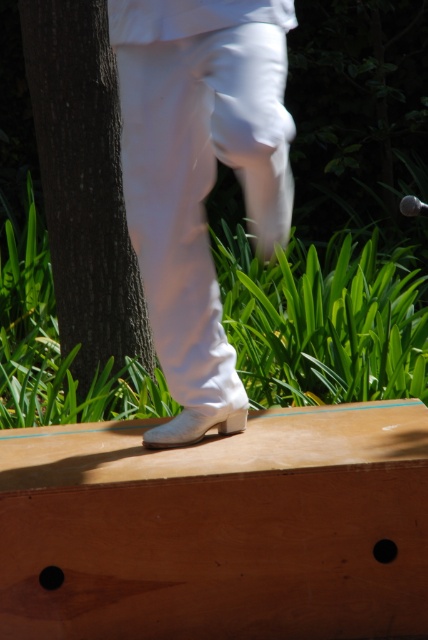
Question: Is white leather boot at center to the right of brown rough bark at left from the viewer's perspective?

Choices:
 (A) no
 (B) yes

Answer: (B)

Question: Which object appears farthest from the camera in this image?

Choices:
 (A) brown rough bark at left
 (B) metallic silver microphone at center
 (C) white leather boot at center

Answer: (A)

Question: Which of the following is the farthest from the observer?

Choices:
 (A) (180, 269)
 (B) (95, 35)
 (C) (416, 205)

Answer: (B)

Question: Considering the relative positions of white leather boot at center and metallic silver microphone at center in the image provided, where is white leather boot at center located with respect to metallic silver microphone at center?

Choices:
 (A) right
 (B) left

Answer: (B)

Question: From the image, what is the correct spatial relationship of white leather boot at center in relation to brown rough bark at left?

Choices:
 (A) above
 (B) below

Answer: (B)

Question: Which point is farther to the camera?

Choices:
 (A) metallic silver microphone at center
 (B) brown rough bark at left

Answer: (B)